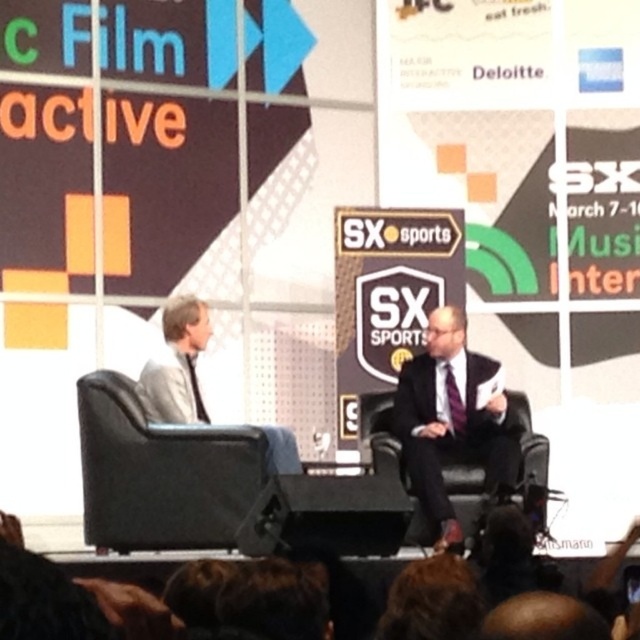
You are an event photographer who needs to capture a clear shot of both the brown hair at lower center and the purple satin tie at center. Based on their positions, which object should you focus on first to ensure both are in frame?

The brown hair at lower center has a lesser height compared to the purple satin tie at center, so you should focus on the purple satin tie at center first to ensure both are in frame.

You are a photographer positioned at the back of the conference hall. You need to take a photo of the black leather chair at left and the brown hair at lower center so that both are clearly visible in the frame. Given that your camera has a maximum focus range of 10 meters, will you be able to capture both subjects in sharp focus?

The black leather chair at left and brown hair at lower center are 11.21 meters apart from each other. Since the distance between them exceeds the camera maximum focus range of 10 meters, the photographer will not be able to capture both subjects in sharp focus.

You are an attendee at the SX Sports conference and want to take a photo of the brown hair at lower center without including the black leather chair at left in the frame. Is this possible based on their positions?

The black leather chair at left is further to the viewer than brown hair at lower center, so it would block the view of the brown hair at lower center. Therefore, it might not be possible to take a photo of the brown hair at lower center without including the black leather chair at left in the frame.